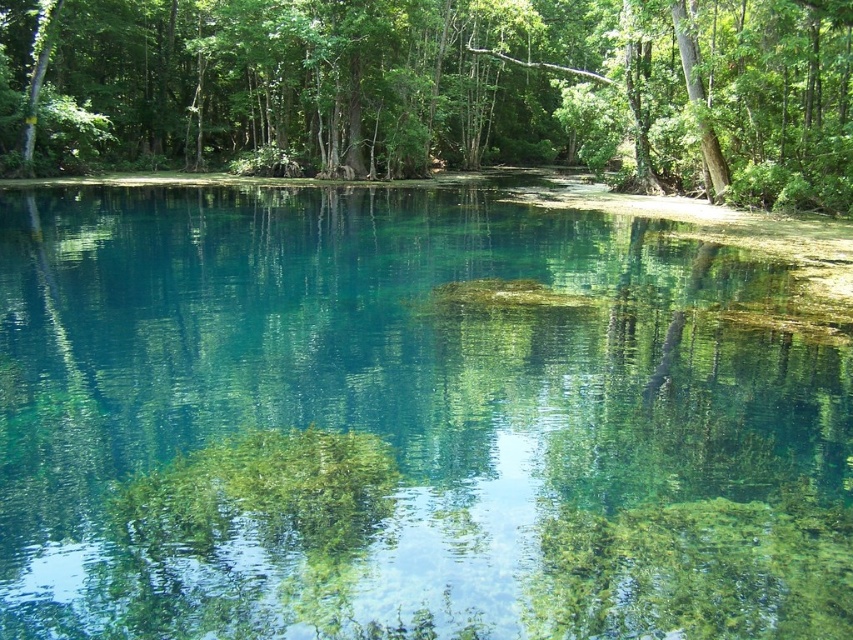
Question: Can you confirm if clear glassy water at center is bigger than green leafy tree at upper center?

Choices:
 (A) no
 (B) yes

Answer: (A)

Question: Is clear glassy water at center to the left of green leafy tree at upper center from the viewer's perspective?

Choices:
 (A) yes
 (B) no

Answer: (A)

Question: Which of the following is the farthest from the observer?

Choices:
 (A) clear glassy water at center
 (B) green leafy tree at upper center

Answer: (B)

Question: Is the position of clear glassy water at center more distant than that of green leafy tree at upper center?

Choices:
 (A) no
 (B) yes

Answer: (A)